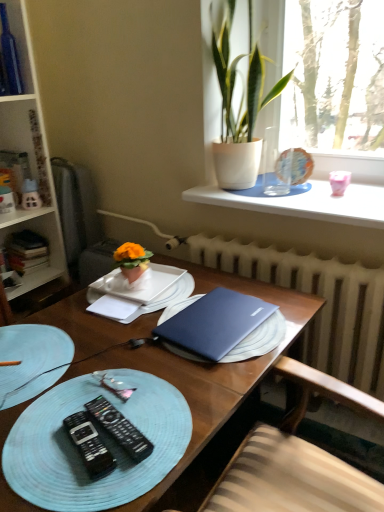
Where is `vacant space to the right of black plastic remote control at lower left, positioned as the 1th remote control in left-to-right order`? vacant space to the right of black plastic remote control at lower left, positioned as the 1th remote control in left-to-right order is located at coordinates (168, 433).